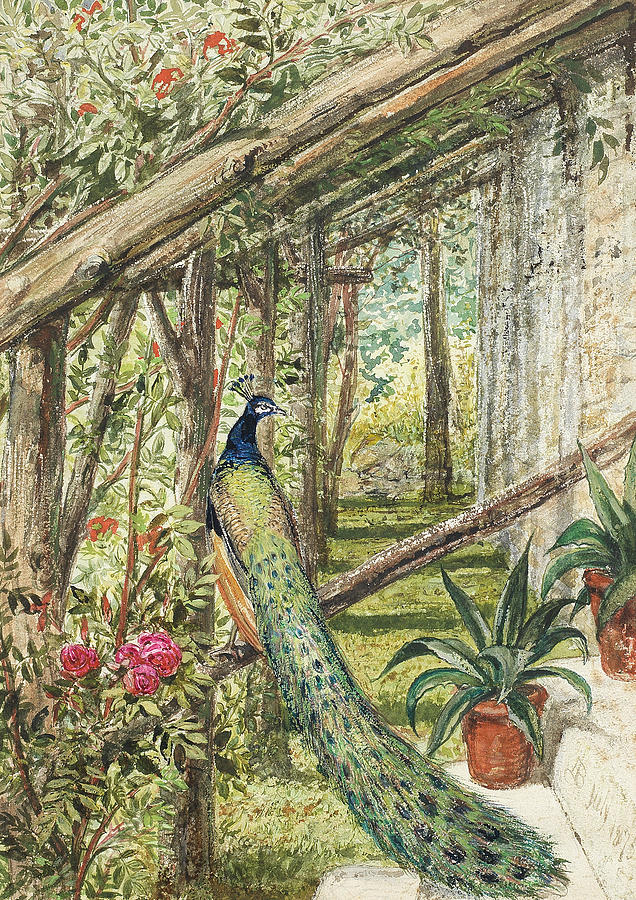
The image size is (636, 900). I want to click on brown pots, so click(501, 757), click(619, 634).